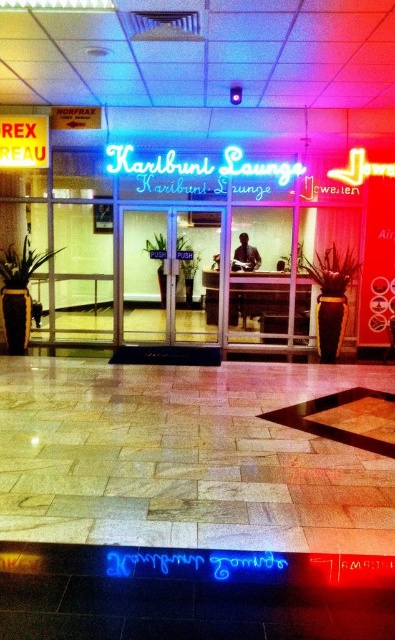
Question: Does transparent glass doors at center have a smaller size compared to neon sign at center?

Choices:
 (A) yes
 (B) no

Answer: (B)

Question: Is transparent glass doors at center positioned before neon sign at center?

Choices:
 (A) yes
 (B) no

Answer: (B)

Question: Which point is closer to the camera taking this photo?

Choices:
 (A) (148, 321)
 (B) (188, 182)

Answer: (B)

Question: Does transparent glass doors at center appear under neon sign at center?

Choices:
 (A) yes
 (B) no

Answer: (A)

Question: Which object is farther from the camera taking this photo?

Choices:
 (A) transparent glass doors at center
 (B) neon sign at center

Answer: (A)

Question: Which point appears farthest from the camera in this image?

Choices:
 (A) (186, 218)
 (B) (131, 160)

Answer: (A)